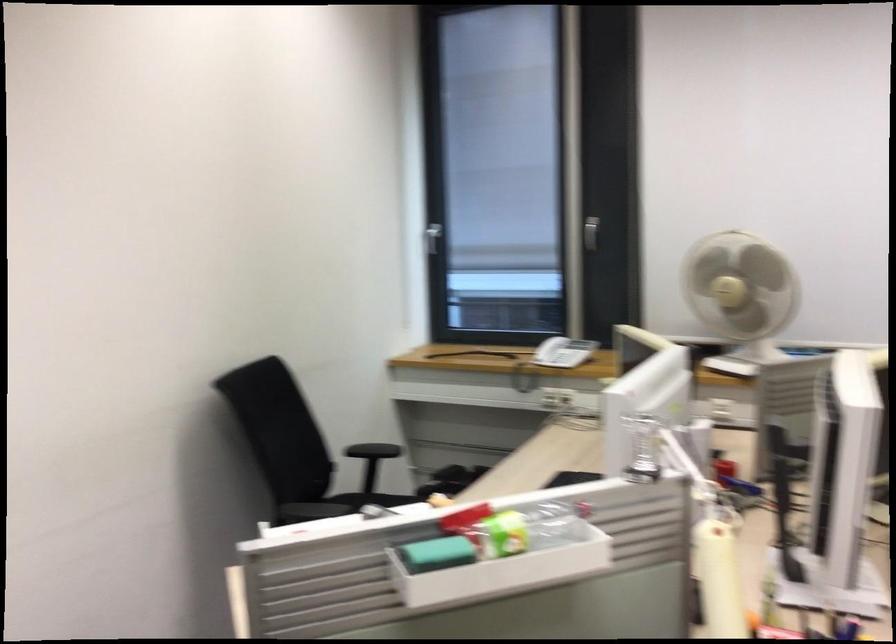
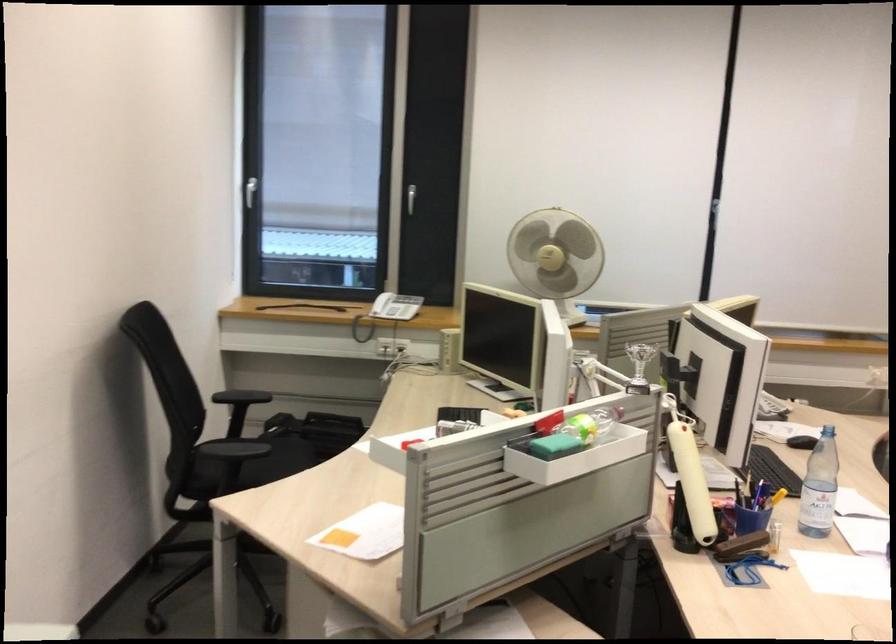
The point at (444, 554) is marked in the first image. Where is the corresponding point in the second image?

(554, 446)